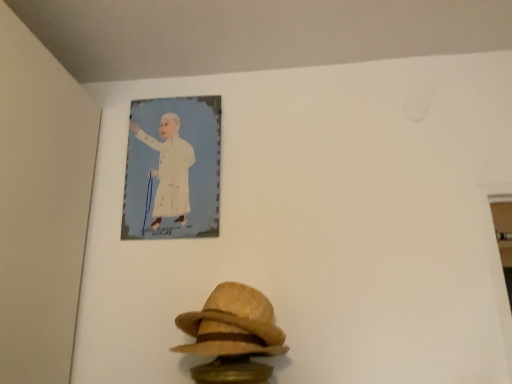
Question: Is felt straw fedora at lower center wider than white paper portrait at upper center?

Choices:
 (A) no
 (B) yes

Answer: (B)

Question: Considering the relative sizes of felt straw fedora at lower center and white paper portrait at upper center in the image provided, is felt straw fedora at lower center taller than white paper portrait at upper center?

Choices:
 (A) no
 (B) yes

Answer: (A)

Question: Is felt straw fedora at lower center to the left of white paper portrait at upper center from the viewer's perspective?

Choices:
 (A) no
 (B) yes

Answer: (A)

Question: Is the position of felt straw fedora at lower center more distant than that of white paper portrait at upper center?

Choices:
 (A) yes
 (B) no

Answer: (B)

Question: From a real-world perspective, is felt straw fedora at lower center physically below white paper portrait at upper center?

Choices:
 (A) no
 (B) yes

Answer: (B)

Question: Does felt straw fedora at lower center have a larger size compared to white paper portrait at upper center?

Choices:
 (A) yes
 (B) no

Answer: (A)

Question: Does white paper portrait at upper center lie behind felt straw fedora at lower center?

Choices:
 (A) no
 (B) yes

Answer: (B)

Question: Can you confirm if white paper portrait at upper center is wider than felt straw fedora at lower center?

Choices:
 (A) yes
 (B) no

Answer: (B)

Question: Is white paper portrait at upper center aimed at felt straw fedora at lower center?

Choices:
 (A) no
 (B) yes

Answer: (A)

Question: From a real-world perspective, is white paper portrait at upper center on top of felt straw fedora at lower center?

Choices:
 (A) no
 (B) yes

Answer: (B)

Question: Is white paper portrait at upper center at the left side of felt straw fedora at lower center?

Choices:
 (A) yes
 (B) no

Answer: (A)

Question: Is white paper portrait at upper center turned away from felt straw fedora at lower center?

Choices:
 (A) yes
 (B) no

Answer: (B)

Question: Would you say felt straw fedora at lower center is inside or outside white paper portrait at upper center?

Choices:
 (A) inside
 (B) outside

Answer: (B)